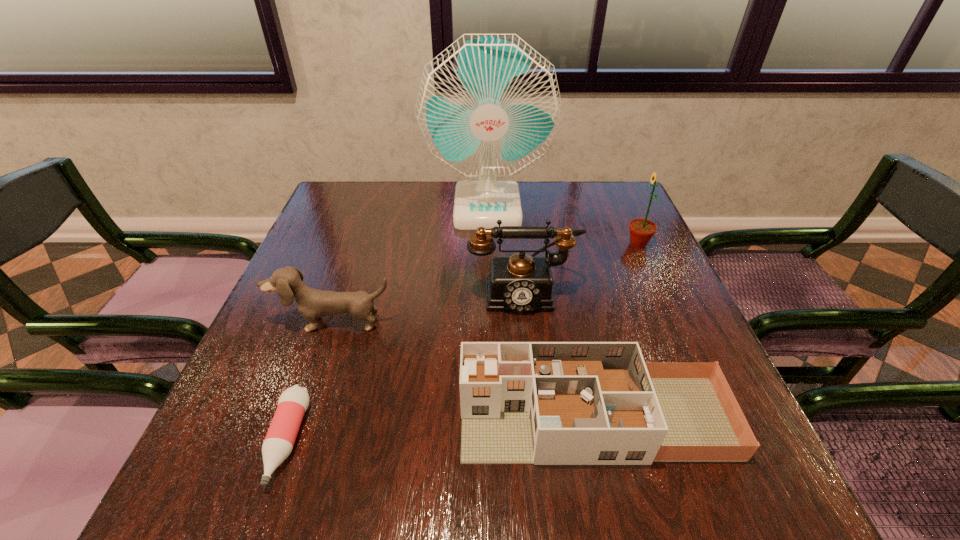
I want to click on vacant area that satisfies the following two spatial constraints: 1. on the face of the sunflower; 2. with the cap open on the bottle, so click(x=727, y=441).

Identify the location of free space that satisfies the following two spatial constraints: 1. on the face of the sunflower; 2. at the face of the puppy. Image resolution: width=960 pixels, height=540 pixels. [x=673, y=323].

Locate an element on the screen. The image size is (960, 540). free spot that satisfies the following two spatial constraints: 1. at the front door of the dollhouse; 2. with the cap open on the bottle is located at coordinates pos(599,441).